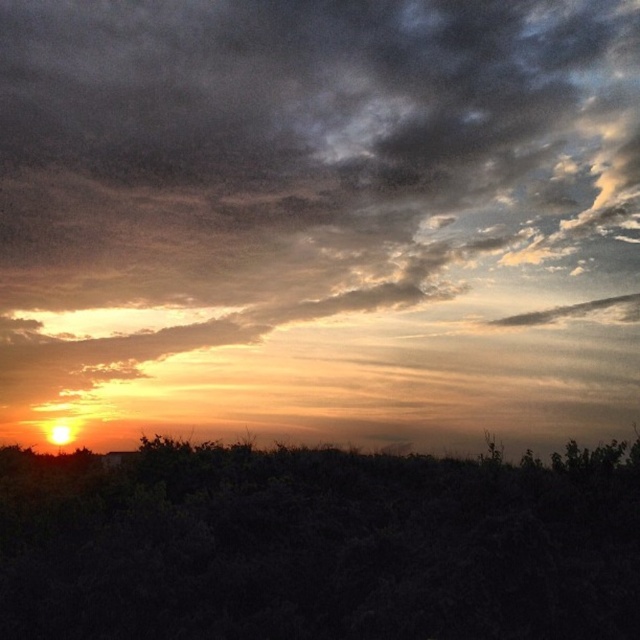
Question: Is the position of cloudy sky at upper center more distant than that of orange matte horizon at lower center?

Choices:
 (A) no
 (B) yes

Answer: (B)

Question: Among these objects, which one is nearest to the camera?

Choices:
 (A) orange matte horizon at lower center
 (B) cloudy sky at upper center

Answer: (A)

Question: Which of the following is the closest to the observer?

Choices:
 (A) cloudy sky at upper center
 (B) orange matte horizon at lower center

Answer: (B)

Question: Can you confirm if cloudy sky at upper center is wider than orange matte horizon at lower center?

Choices:
 (A) no
 (B) yes

Answer: (B)

Question: Can you confirm if cloudy sky at upper center is thinner than orange matte horizon at lower center?

Choices:
 (A) no
 (B) yes

Answer: (A)

Question: Which point appears farthest from the camera in this image?

Choices:
 (A) (250, 241)
 (B) (596, 604)

Answer: (A)